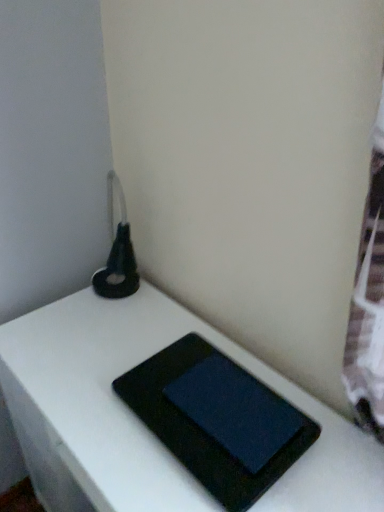
The image size is (384, 512). Identify the location of free space above black matte book at center (from a real-world perspective). (117, 375).